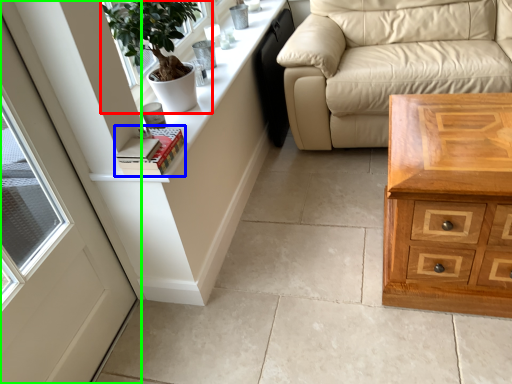
Question: Considering the real-world distances, which object is closest to houseplant (highlighted by a red box)? book (highlighted by a blue box) or door (highlighted by a green box).

Choices:
 (A) book
 (B) door

Answer: (A)